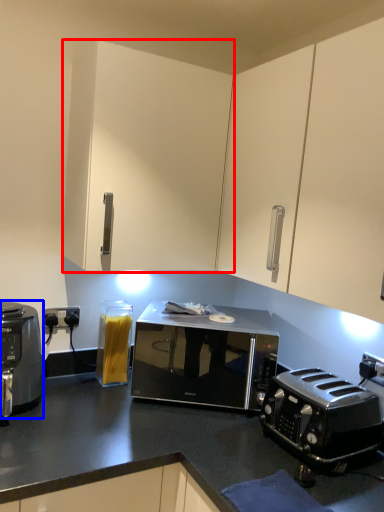
Question: Which object appears closest to the camera in this image, cabinetry (highlighted by a red box) or home appliance (highlighted by a blue box)?

Choices:
 (A) cabinetry
 (B) home appliance

Answer: (B)